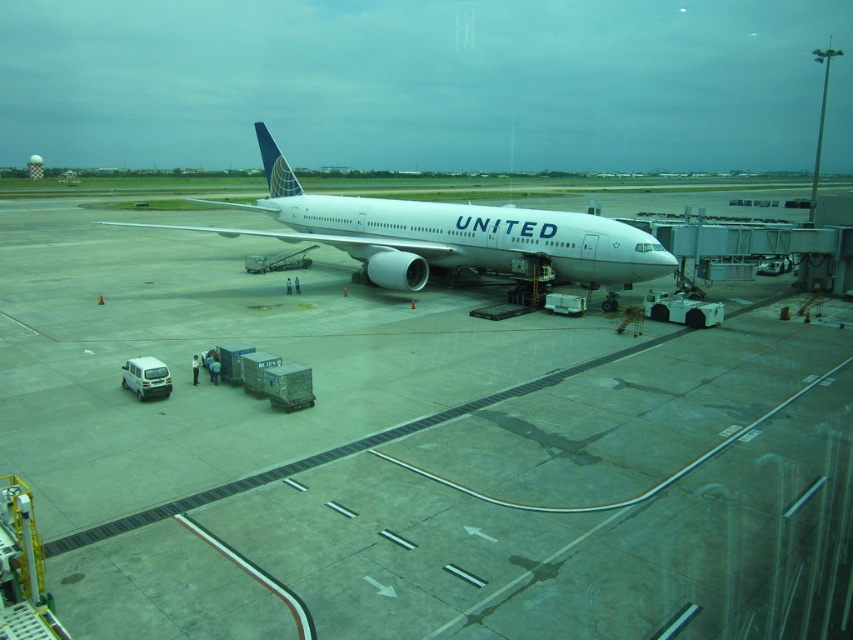
Question: Considering the relative positions of white smooth tarmac at center and white glossy airplane at center in the image provided, where is white smooth tarmac at center located with respect to white glossy airplane at center?

Choices:
 (A) right
 (B) left

Answer: (A)

Question: From the image, what is the correct spatial relationship of white smooth tarmac at center in relation to white glossy airplane at center?

Choices:
 (A) left
 (B) right

Answer: (B)

Question: Among these objects, which one is farthest from the camera?

Choices:
 (A) white glossy airplane at center
 (B) white smooth tarmac at center

Answer: (A)

Question: Observing the image, what is the correct spatial positioning of white smooth tarmac at center in reference to white glossy airplane at center?

Choices:
 (A) above
 (B) below

Answer: (B)

Question: Which of the following is the closest to the observer?

Choices:
 (A) white smooth tarmac at center
 (B) white glossy airplane at center

Answer: (A)